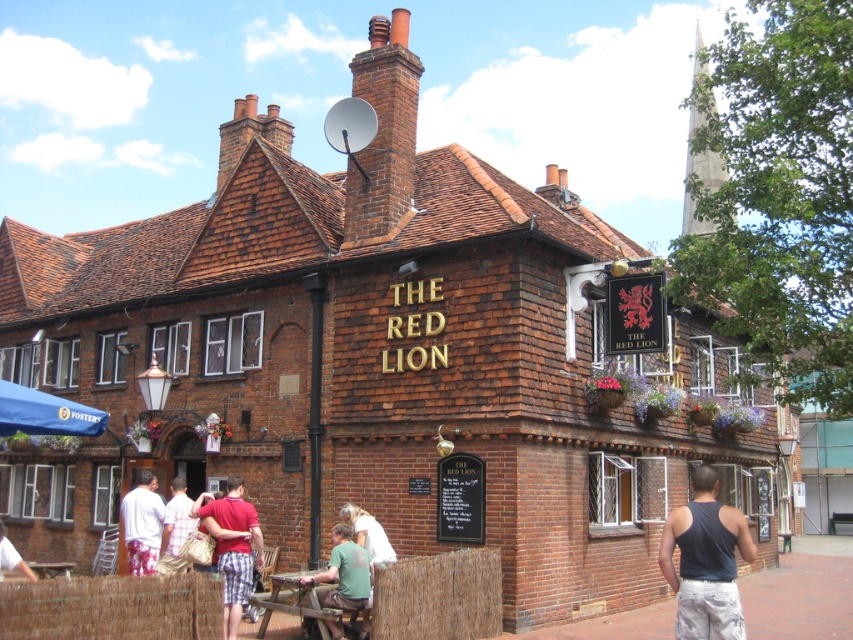
Consider the image. Does green cotton shirt at lower center have a smaller size compared to white cotton shirt at center?

Yes, green cotton shirt at lower center is smaller than white cotton shirt at center.

Is green cotton shirt at lower center closer to the viewer compared to white cotton shirt at center?

Yes, it is.

What do you see at coordinates (343, 572) in the screenshot?
I see `green cotton shirt at lower center` at bounding box center [343, 572].

Locate an element on the screen. Image resolution: width=853 pixels, height=640 pixels. green cotton shirt at lower center is located at coordinates (343, 572).

Describe the element at coordinates (705, 561) in the screenshot. I see `dark blue tank top at center` at that location.

Who is more forward, (683, 632) or (138, 532)?

Point (683, 632) is more forward.

Image resolution: width=853 pixels, height=640 pixels. What are the coordinates of `dark blue tank top at center` in the screenshot? It's located at (705, 561).

Looking at this image, can you confirm if plaid shorts at center is positioned below white cotton shorts at lower left?

Correct, plaid shorts at center is located below white cotton shorts at lower left.

Between point (202, 506) and point (138, 500), which one is positioned in front?

Point (202, 506) is in front.

Image resolution: width=853 pixels, height=640 pixels. Describe the element at coordinates (234, 580) in the screenshot. I see `plaid shorts at center` at that location.

The width and height of the screenshot is (853, 640). In order to click on plaid shorts at center in this screenshot , I will do `click(234, 580)`.